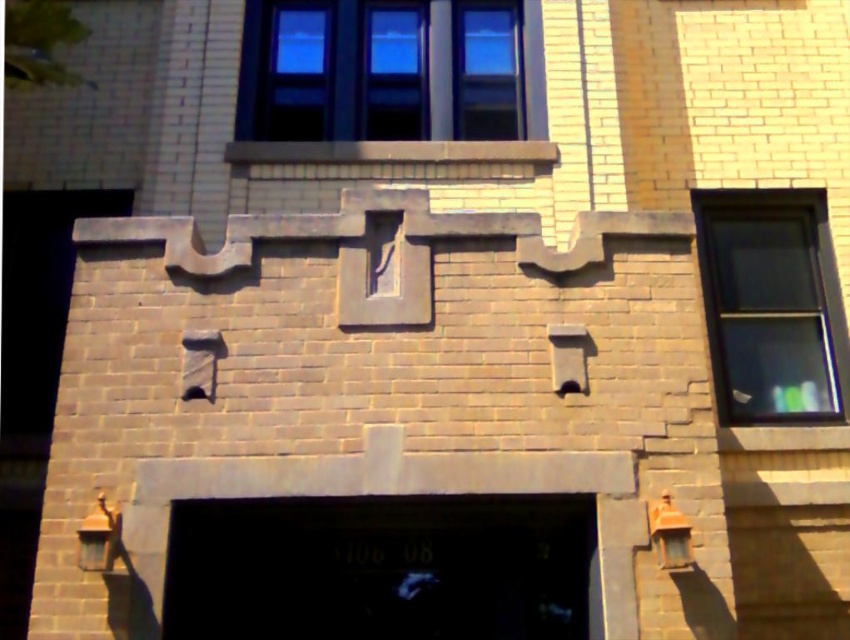
Can you confirm if clear glass window at upper center is positioned below clear glass window at right?

No, clear glass window at upper center is not below clear glass window at right.

Is clear glass window at upper center smaller than clear glass window at right?

No.

Which is behind, point (391, 124) or point (740, 204)?

Positioned behind is point (391, 124).

Find the location of `clear glass window at upper center`. clear glass window at upper center is located at coordinates (382, 70).

Is black glass door at center shorter than clear glass window at upper center?

Yes.

Is point (581, 614) more distant than point (418, 12)?

No, (581, 614) is in front of (418, 12).

Locate an element on the screen. The width and height of the screenshot is (850, 640). black glass door at center is located at coordinates (378, 568).

This screenshot has height=640, width=850. Find the location of `black glass door at center`. black glass door at center is located at coordinates (x=378, y=568).

Is black glass door at center positioned before clear glass window at right?

Yes, it is in front of clear glass window at right.

Which is above, black glass door at center or clear glass window at right?

clear glass window at right is higher up.

Between point (449, 540) and point (843, 387), which one is positioned behind?

Positioned behind is point (843, 387).

Identify the location of black glass door at center. (378, 568).